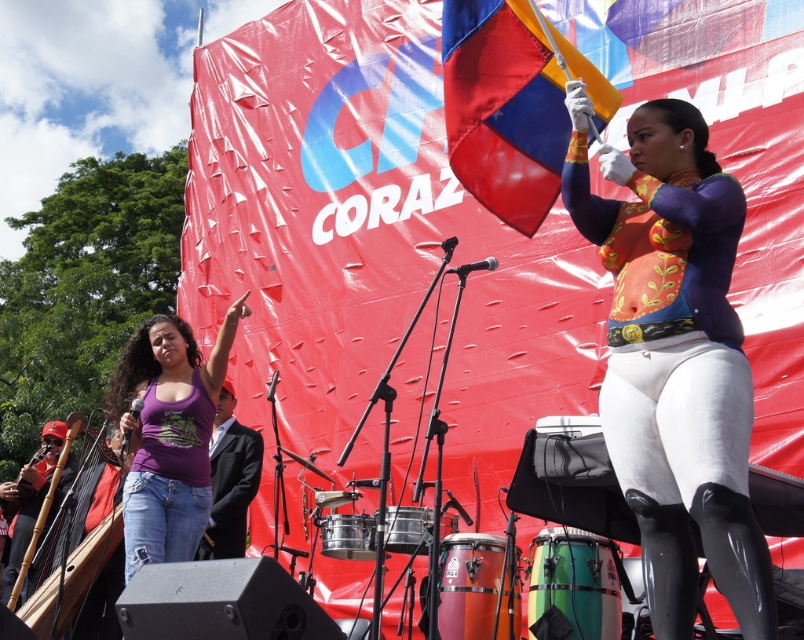
Question: Which point is closer to the camera?

Choices:
 (A) purple fabric shirt at left
 (B) matte blue and orange vest at center

Answer: (B)

Question: Does matte blue and orange vest at center appear under purple cotton tank top at lower left?

Choices:
 (A) yes
 (B) no

Answer: (B)

Question: Considering the real-world distances, which object is closest to the polyester flag at upper center?

Choices:
 (A) purple fabric shirt at left
 (B) matte blue and orange vest at center
 (C) purple cotton tank top at lower left

Answer: (B)

Question: Is matte blue and orange vest at center positioned behind polyester flag at upper center?

Choices:
 (A) yes
 (B) no

Answer: (B)

Question: From the image, what is the correct spatial relationship of matte blue and orange vest at center in relation to purple cotton tank top at lower left?

Choices:
 (A) right
 (B) left

Answer: (A)

Question: Estimate the real-world distances between objects in this image. Which object is farther from the purple cotton tank top at lower left?

Choices:
 (A) purple fabric shirt at left
 (B) matte blue and orange vest at center

Answer: (B)